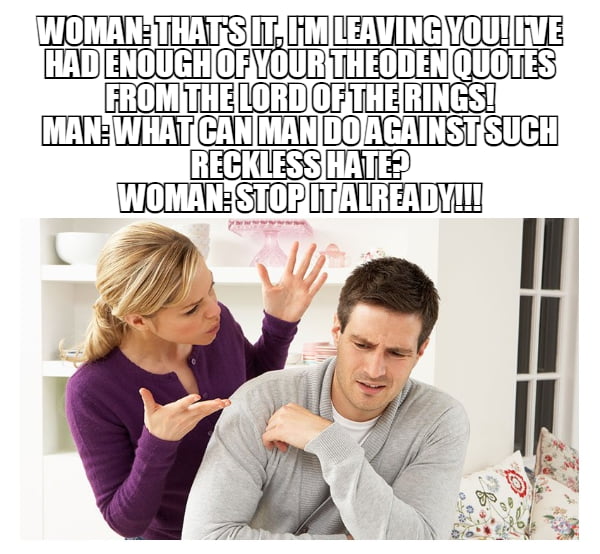
You are a GUI agent. You are given a task and a screenshot of the screen. Output one action in this format:
    pyautogui.click(x=<x>, y=<y>)
    Task: Click on the window
    Image resolution: width=600 pixels, height=554 pixels.
    Given the screenshot: What is the action you would take?
    pyautogui.click(x=550, y=330)